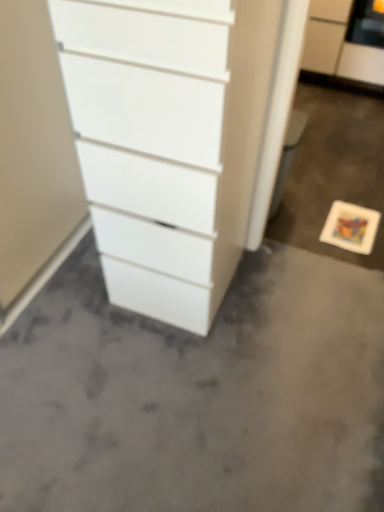
Find the location of a particular element. vacant area that lies in front of white glossy chest of drawers at center is located at coordinates (179, 369).